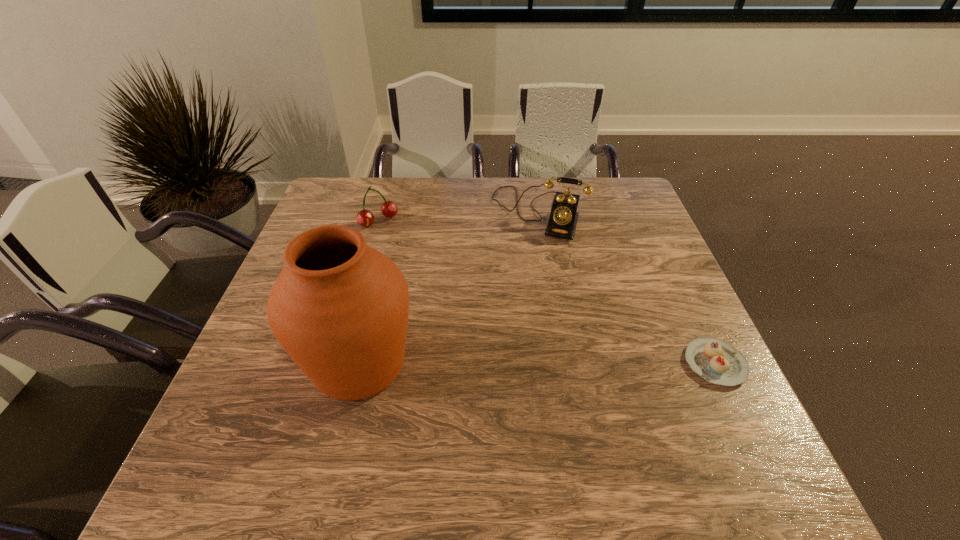
Where is `vacant space that is in between the cherry and the third object from left to right`? vacant space that is in between the cherry and the third object from left to right is located at coordinates tap(459, 217).

Find the location of a particular element. This screenshot has width=960, height=540. unoccupied area between the rightmost object and the third object from left to right is located at coordinates (627, 288).

Locate an element on the screen. The image size is (960, 540). object that stands as the third closest to the cherry is located at coordinates (717, 361).

Point out which object is positioned as the second nearest to the urn. Please provide its 2D coordinates. Your answer should be formatted as a tuple, i.e. [(x, y)], where the tuple contains the x and y coordinates of a point satisfying the conditions above.

[(365, 218)]

At what (x,y) coordinates should I click in order to perform the action: click on vacant point that satisfies the following two spatial constraints: 1. on the back side of the urn; 2. on the left side of the telephone. Please return your answer as a coordinate pair (x, y). This screenshot has width=960, height=540. Looking at the image, I should click on (396, 213).

Image resolution: width=960 pixels, height=540 pixels. Identify the location of vacant area in the image that satisfies the following two spatial constraints: 1. on the front side of the urn; 2. on the left side of the cherry. (339, 363).